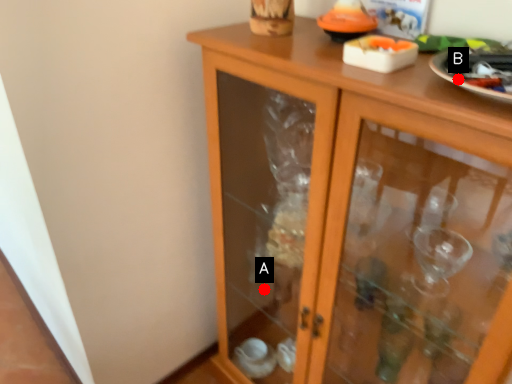
Question: Two points are circled on the image, labeled by A and B beside each circle. Which point is closer to the camera taking this photo?

Choices:
 (A) A is closer
 (B) B is closer

Answer: (B)